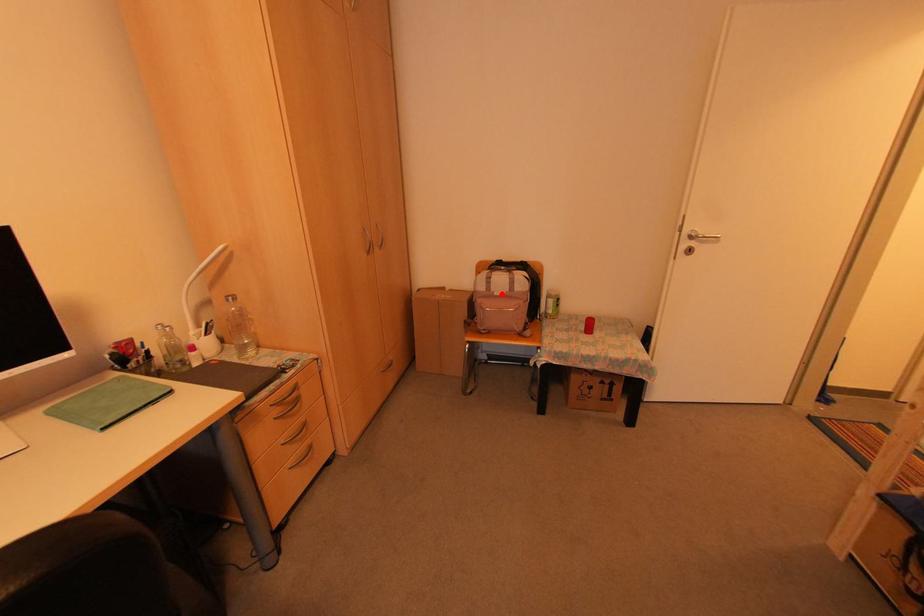
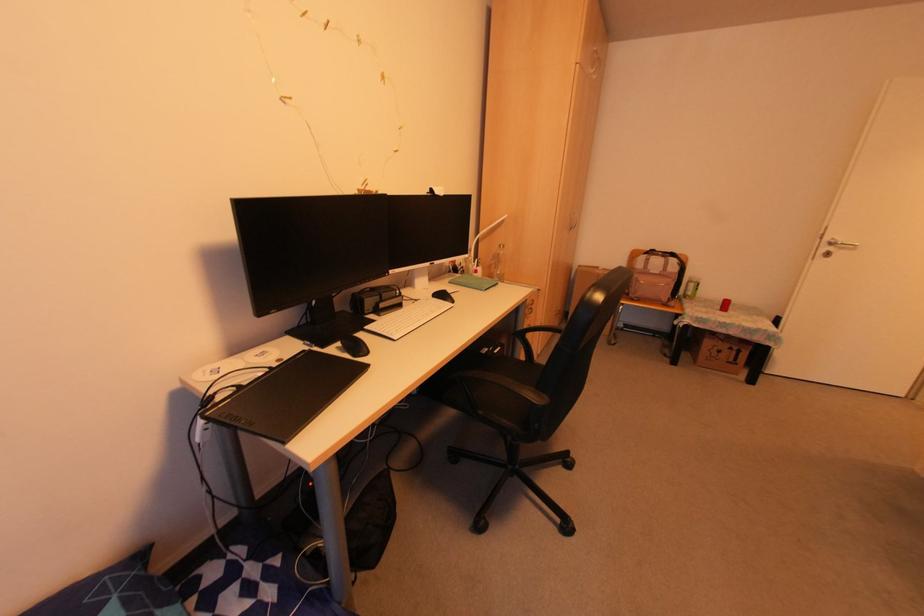
The point at the highlighted location is marked in the first image. Where is the corresponding point in the second image?

(655, 273)